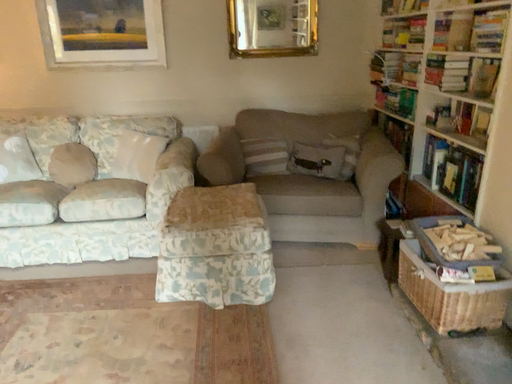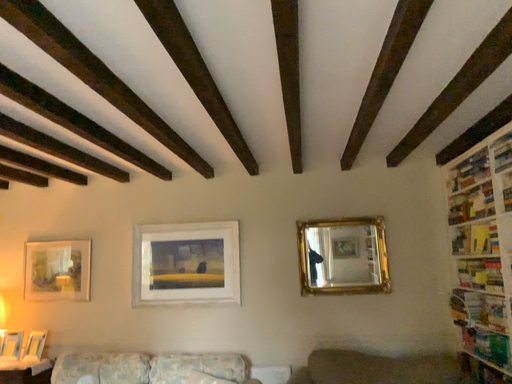
Question: Which way did the camera rotate in the video?

Choices:
 (A) rotated left
 (B) rotated right

Answer: (A)